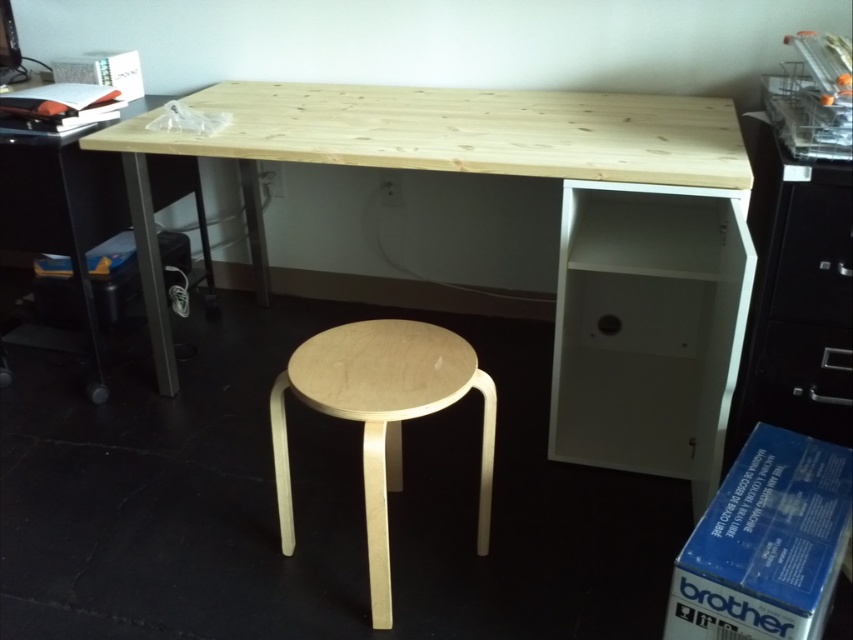
Question: Does natural wood stool at center come behind matte white drawer at right?

Choices:
 (A) yes
 (B) no

Answer: (B)

Question: Which point appears closest to the camera in this image?

Choices:
 (A) (814, 348)
 (B) (540, 154)
 (C) (813, 170)

Answer: (C)

Question: Does black plastic file cabinet at right appear over matte white drawer at right?

Choices:
 (A) no
 (B) yes

Answer: (B)

Question: Which point is farther from the camera taking this photo?

Choices:
 (A) (846, 364)
 (B) (827, 310)

Answer: (A)

Question: Among these objects, which one is farthest from the camera?

Choices:
 (A) white matte drawer at center
 (B) matte white drawer at right
 (C) natural wood desk at center
 (D) black plastic file cabinet at right

Answer: (A)

Question: Does black plastic file cabinet at right have a larger size compared to white matte drawer at center?

Choices:
 (A) yes
 (B) no

Answer: (A)